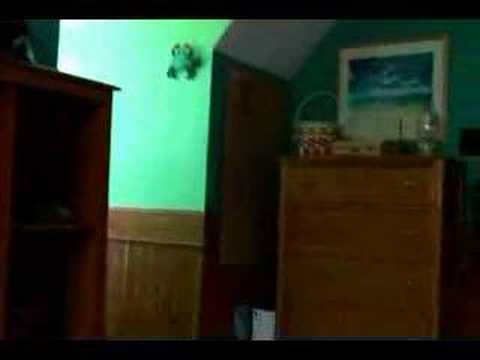
You are a GUI agent. You are given a task and a screenshot of the screen. Output one action in this format:
    pyautogui.click(x=<x>, y=<y>)
    Task: Click on the wood sided wall
    This screenshot has width=480, height=360.
    Given the screenshot: What is the action you would take?
    pyautogui.click(x=167, y=279), pyautogui.click(x=217, y=282)